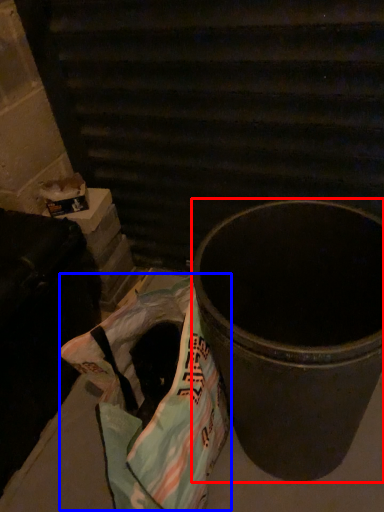
Question: Which object is further to the camera taking this photo, waste container (highlighted by a red box) or grocery bag (highlighted by a blue box)?

Choices:
 (A) waste container
 (B) grocery bag

Answer: (B)